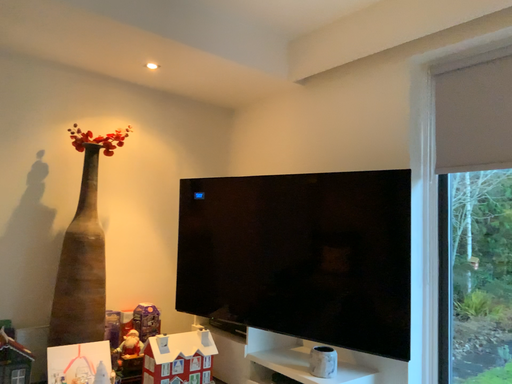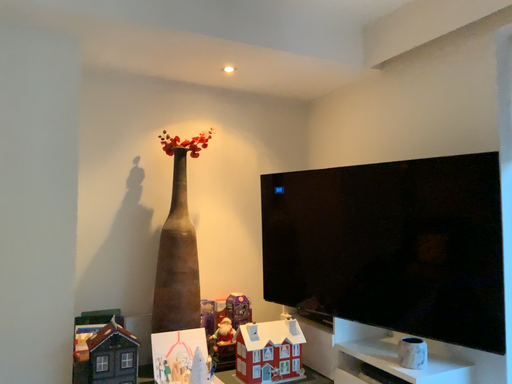
Question: Which way did the camera rotate in the video?

Choices:
 (A) rotated left
 (B) rotated right

Answer: (A)